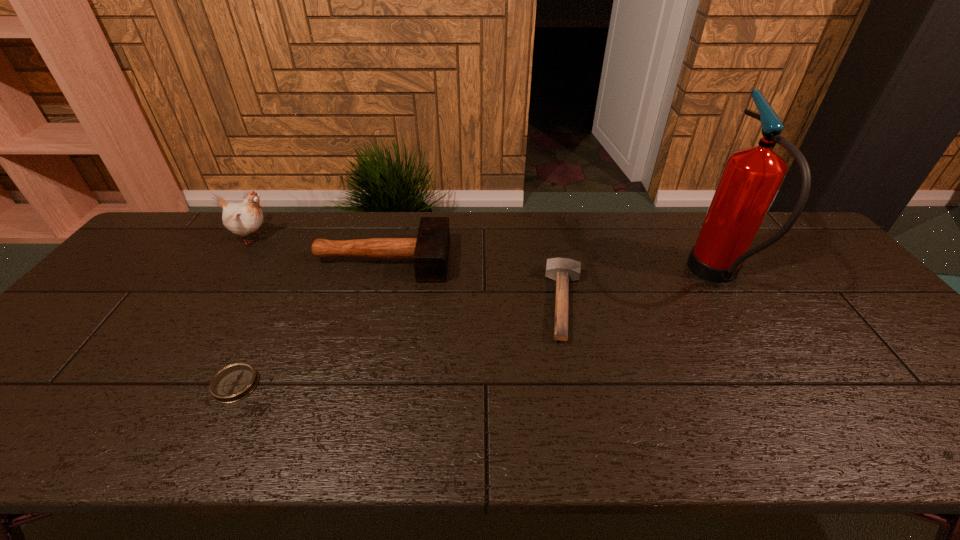
Locate an element on the screen. Image resolution: width=960 pixels, height=540 pixels. fire extinguisher is located at coordinates (752, 176).

Find the location of a particular element. The width and height of the screenshot is (960, 540). the tallest object is located at coordinates (752, 176).

At what (x,y) coordinates should I click in order to perform the action: click on the leftmost object. Please return your answer as a coordinate pair (x, y). Looking at the image, I should click on (244, 218).

Identify the location of bird. (244, 218).

Find the location of a particular element. the third object from left to right is located at coordinates (430, 250).

Find the location of a particular element. The image size is (960, 540). the left mallet is located at coordinates (430, 250).

Find the location of `the right mallet`. the right mallet is located at coordinates (563, 270).

You are a GUI agent. You are given a task and a screenshot of the screen. Output one action in this format:
    pyautogui.click(x=<x>, y=<y>)
    Task: Click on the fourth object from left to right
    The height and width of the screenshot is (540, 960).
    Given the screenshot: What is the action you would take?
    pyautogui.click(x=563, y=270)

I want to click on the nearest object, so click(x=235, y=382).

Locate an element on the screen. This screenshot has height=540, width=960. the shortest object is located at coordinates (235, 382).